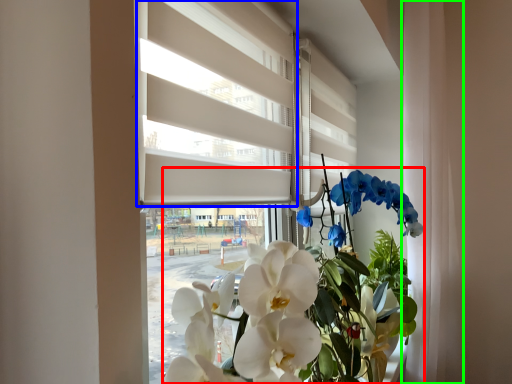
Question: Estimate the real-world distances between objects in this image. Which object is closer to floral arrangement (highlighted by a red box), blind (highlighted by a blue box) or curtain (highlighted by a green box)?

Choices:
 (A) blind
 (B) curtain

Answer: (B)